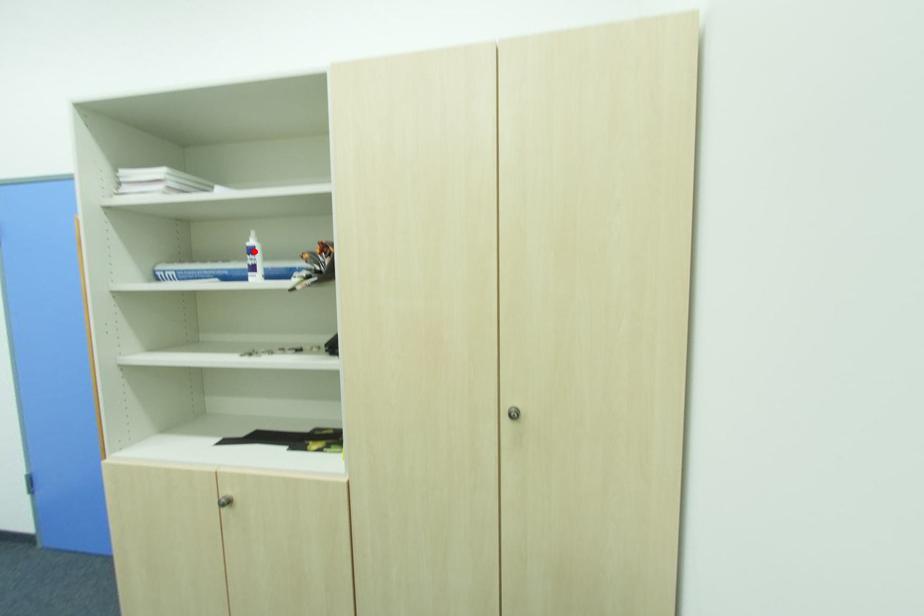
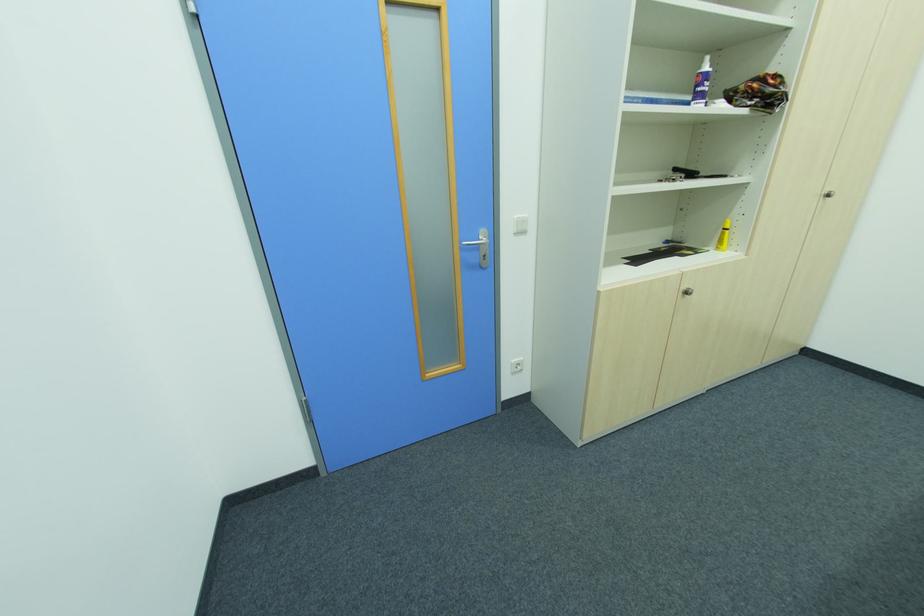
Where in the second image is the point corresponding to the highlighted location from the first image?

(708, 78)